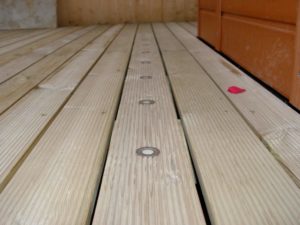
Where is `light grey wall`? This screenshot has width=300, height=225. light grey wall is located at coordinates (20, 18).